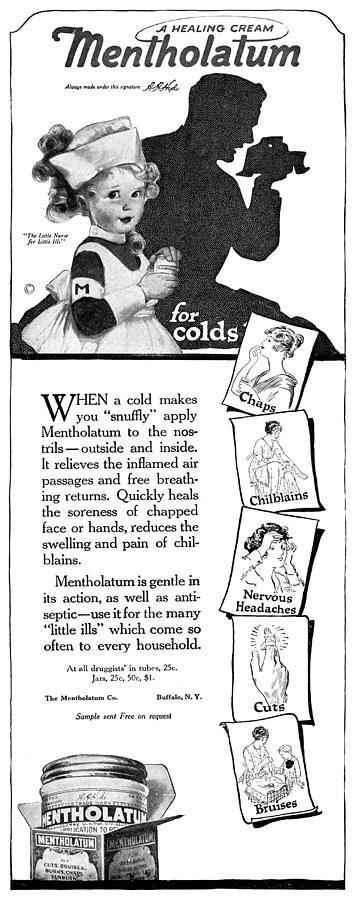
The image size is (354, 900). What are the coordinates of `tissue` in the screenshot? It's located at (279, 147).